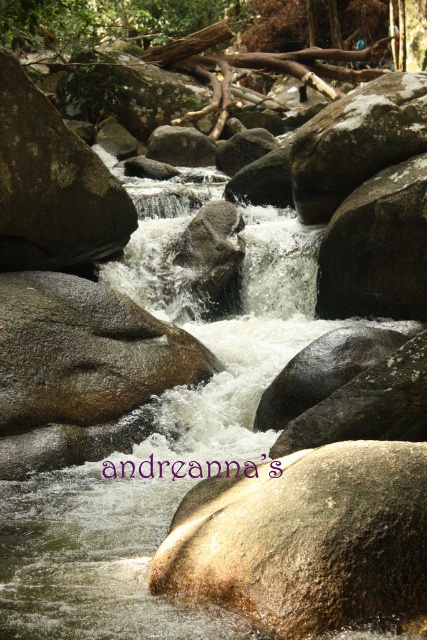
Question: Which of the following is the farthest from the observer?

Choices:
 (A) (274, 406)
 (B) (93, 298)
 (C) (415, 289)

Answer: (C)

Question: Does brown polished rock at center have a larger size compared to matte brown rock at upper left?

Choices:
 (A) yes
 (B) no

Answer: (B)

Question: Is matte brown rock at upper left smaller than shiny dark brown rock at center?

Choices:
 (A) no
 (B) yes

Answer: (A)

Question: Among these points, which one is farthest from the camera?

Choices:
 (A) (227, 499)
 (B) (35, 227)
 (C) (287, 369)
 (D) (373, 216)

Answer: (D)

Question: Which point is farther to the camera?

Choices:
 (A) (366, 140)
 (B) (341, 352)
 (C) (161, 365)
 (D) (18, 252)

Answer: (A)

Question: Can you confirm if brown polished rock at center is bigger than brown rough rock at center?

Choices:
 (A) no
 (B) yes

Answer: (A)